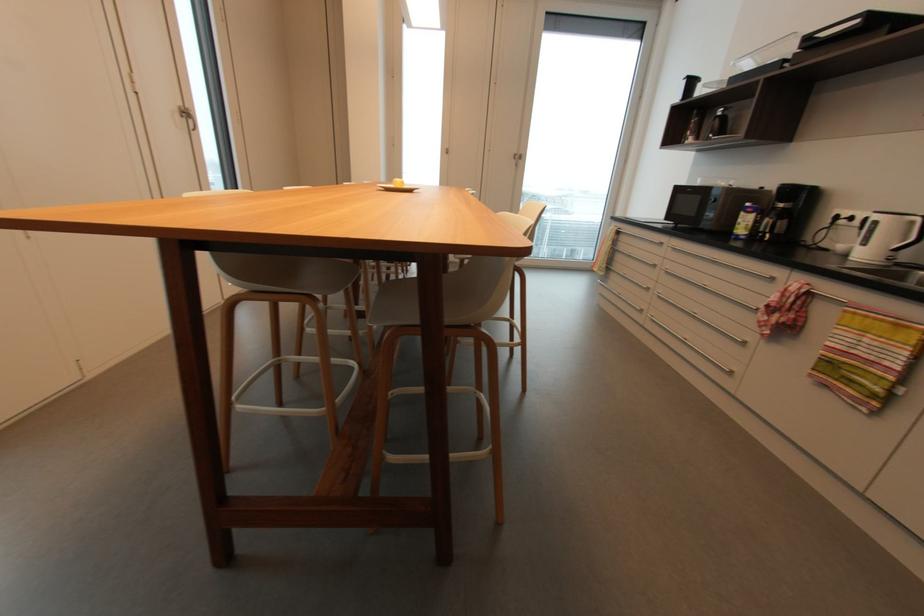
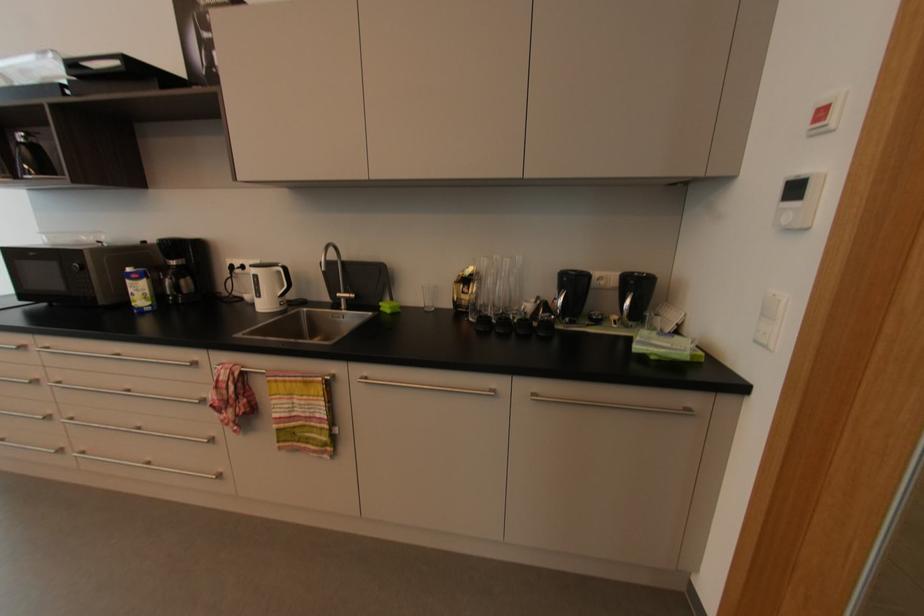
The point at (750, 205) is marked in the first image. Where is the corresponding point in the second image?

(131, 270)